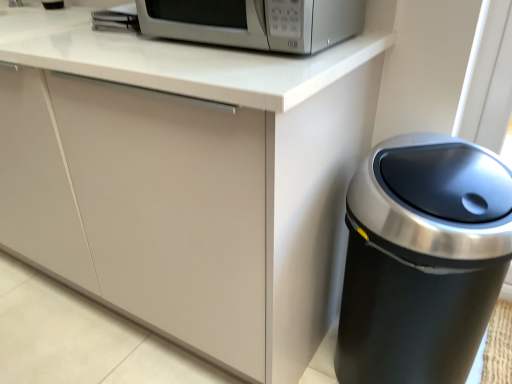
What is the approximate height of satin silver microwave at upper center?

4.49 inches.

The image size is (512, 384). What do you see at coordinates (255, 22) in the screenshot?
I see `satin silver microwave at upper center` at bounding box center [255, 22].

Find the location of `satin silver microwave at upper center`. satin silver microwave at upper center is located at coordinates (255, 22).

Describe the element at coordinates (422, 259) in the screenshot. I see `black metallic trash can at right` at that location.

Identify the location of black metallic trash can at right. (422, 259).

Image resolution: width=512 pixels, height=384 pixels. What are the coordinates of `satin silver microwave at upper center` in the screenshot? It's located at (255, 22).

Is black metallic trash can at right at the right side of satin silver microwave at upper center?

Correct, you'll find black metallic trash can at right to the right of satin silver microwave at upper center.

Looking at this image, which object is further away from the camera taking this photo, black metallic trash can at right or satin silver microwave at upper center?

satin silver microwave at upper center is further from the camera.

Which point is more forward, (449, 374) or (156, 32)?

Positioned in front is point (449, 374).

From the image's perspective, which is above, black metallic trash can at right or satin silver microwave at upper center?

satin silver microwave at upper center, from the image's perspective.

From a real-world perspective, is black metallic trash can at right beneath satin silver microwave at upper center?

Indeed, from a real-world perspective, black metallic trash can at right is positioned beneath satin silver microwave at upper center.

Which object is wider, black metallic trash can at right or satin silver microwave at upper center?

Wider between the two is satin silver microwave at upper center.

In the scene shown: Who is shorter, black metallic trash can at right or satin silver microwave at upper center?

satin silver microwave at upper center.

Considering the relative sizes of black metallic trash can at right and satin silver microwave at upper center in the image provided, is black metallic trash can at right bigger than satin silver microwave at upper center?

Correct, black metallic trash can at right is larger in size than satin silver microwave at upper center.

Is black metallic trash can at right spatially inside satin silver microwave at upper center, or outside of it?

black metallic trash can at right exists outside the volume of satin silver microwave at upper center.

Is black metallic trash can at right directly adjacent to satin silver microwave at upper center?

black metallic trash can at right and satin silver microwave at upper center are clearly separated.

Is black metallic trash can at right looking in the opposite direction of satin silver microwave at upper center?

No.

Identify the location of waste container below the satin silver microwave at upper center (from the image's perspective). (422, 259).

Would you say satin silver microwave at upper center is to the left or to the right of black metallic trash can at right in the picture?

Clearly, satin silver microwave at upper center is on the left of black metallic trash can at right in the image.

Is satin silver microwave at upper center in front of black metallic trash can at right?

That is False.

Is point (241, 27) farther from camera compared to point (434, 319)?

That is False.

From the picture: From the image's perspective, which one is positioned higher, satin silver microwave at upper center or black metallic trash can at right?

satin silver microwave at upper center appears higher in the image.

From a real-world perspective, is satin silver microwave at upper center located higher than black metallic trash can at right?

Yes, from a real-world perspective, satin silver microwave at upper center is above black metallic trash can at right.

Between satin silver microwave at upper center and black metallic trash can at right, which one has smaller width?

black metallic trash can at right is thinner.

Which of these two, satin silver microwave at upper center or black metallic trash can at right, stands shorter?

satin silver microwave at upper center.

Considering the sizes of satin silver microwave at upper center and black metallic trash can at right in the image, is satin silver microwave at upper center bigger or smaller than black metallic trash can at right?

satin silver microwave at upper center is smaller than black metallic trash can at right.

Is satin silver microwave at upper center inside the boundaries of black metallic trash can at right, or outside?

satin silver microwave at upper center is outside black metallic trash can at right.

Are satin silver microwave at upper center and black metallic trash can at right far apart?

No, there isn't a large distance between satin silver microwave at upper center and black metallic trash can at right.

Is satin silver microwave at upper center looking in the opposite direction of black metallic trash can at right?

No.

Can you tell me how much satin silver microwave at upper center and black metallic trash can at right differ in facing direction?

1.77 degrees separate the facing orientations of satin silver microwave at upper center and black metallic trash can at right.

Locate an element on the screen. This screenshot has height=384, width=512. waste container that is below the satin silver microwave at upper center (from the image's perspective) is located at coordinates (422, 259).

Find the location of a particular element. This screenshot has height=384, width=512. waste container below the satin silver microwave at upper center (from the image's perspective) is located at coordinates (422, 259).

Locate an element on the screen. The image size is (512, 384). waste container located on the right of satin silver microwave at upper center is located at coordinates (422, 259).